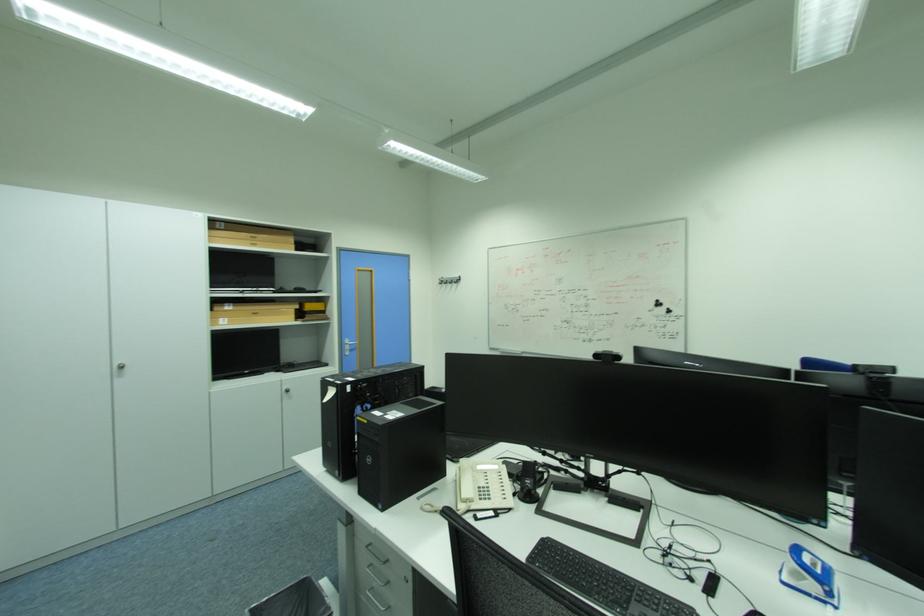
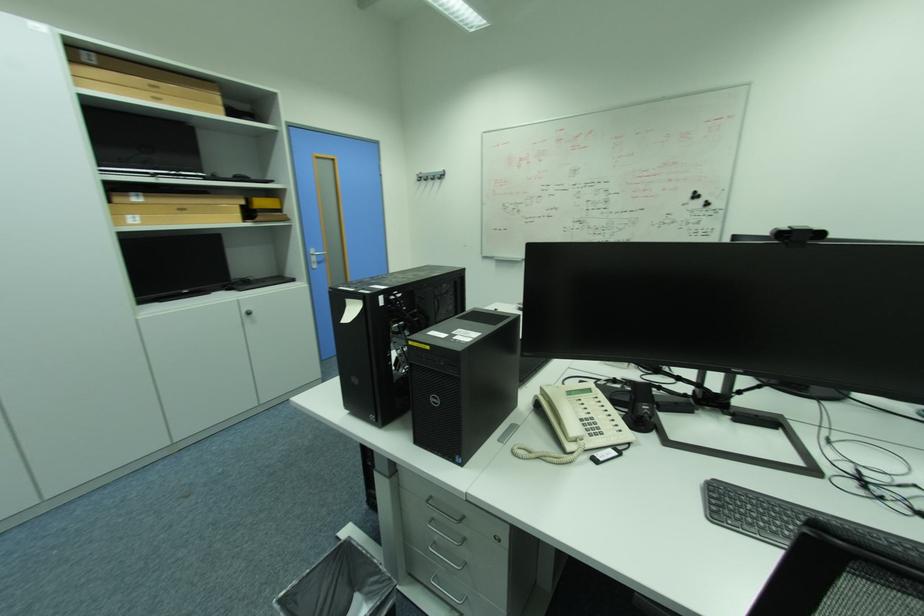
In the second image, find the point that corresponds to point 464,276 in the first image.

(444, 169)